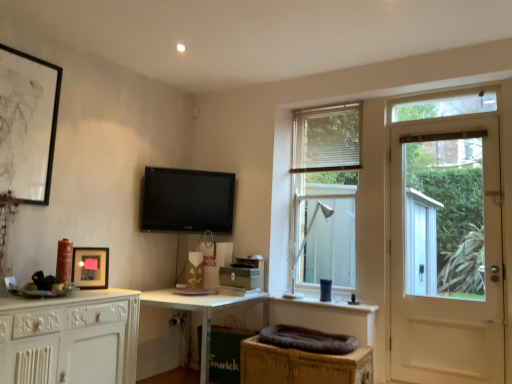
Describe the element at coordinates (304, 246) in the screenshot. I see `white metal table lamp at center` at that location.

Describe the element at coordinates (302, 365) in the screenshot. I see `brown wicker basket at lower center, which is the 1th cabinetry from right to left` at that location.

Describe the element at coordinates (446, 253) in the screenshot. This screenshot has height=384, width=512. I see `white wooden door at right` at that location.

How much space does white matte cabinet at lower left, which appears as the first cabinetry when viewed from the left, occupy vertically?

The height of white matte cabinet at lower left, which appears as the first cabinetry when viewed from the left, is 28.99 inches.

The height and width of the screenshot is (384, 512). Identify the location of white metal table lamp at center. (304, 246).

Does white wood window at center appear on the left side of black glossy tv at upper center?

In fact, white wood window at center is to the right of black glossy tv at upper center.

Is white wood window at center not near black glossy tv at upper center?

No, white wood window at center is not far from black glossy tv at upper center.

Which is correct: white wood window at center is inside black glossy tv at upper center, or outside of it?

white wood window at center cannot be found inside black glossy tv at upper center.

Which of these two, white wood window at center or black glossy tv at upper center, stands shorter?

black glossy tv at upper center.

Does white matte cabinet at lower left, which ranks as the 2th cabinetry in right-to-left order, have a lesser width compared to white wood window at center?

In fact, white matte cabinet at lower left, which ranks as the 2th cabinetry in right-to-left order, might be wider than white wood window at center.

From the picture: Is white matte cabinet at lower left, which ranks as the 2th cabinetry in right-to-left order, at the right side of white wood window at center?

No, white matte cabinet at lower left, which ranks as the 2th cabinetry in right-to-left order, is not to the right of white wood window at center.

From the image's perspective, would you say white matte cabinet at lower left, which ranks as the 2th cabinetry in right-to-left order, is shown under white wood window at center?

Indeed, from the image's perspective, white matte cabinet at lower left, which ranks as the 2th cabinetry in right-to-left order, is shown beneath white wood window at center.

From a real-world perspective, does white matte cabinet at lower left, which ranks as the 2th cabinetry in right-to-left order, sit lower than white wood window at center?

Yes.

In the scene shown: In terms of size, does white wooden door at right appear bigger or smaller than white metal table lamp at center?

Considering their sizes, white wooden door at right takes up more space than white metal table lamp at center.

From a real-world perspective, relative to white metal table lamp at center, is white wooden door at right vertically above or below?

white wooden door at right is above white metal table lamp at center.

Considering the sizes of objects white wooden door at right and white metal table lamp at center in the image provided, who is thinner, white wooden door at right or white metal table lamp at center?

white wooden door at right is thinner.

Between white wooden door at right and white metal table lamp at center, which one appears on the left side from the viewer's perspective?

white metal table lamp at center.

Which is nearer, (80, 284) or (159, 207)?

Clearly, point (80, 284) is closer to the camera than point (159, 207).

From a real-world perspective, which object stands above the other?

black glossy tv at upper center.

Considering the positions of objects matte black picture frame at left, marked as the 1th picture frame in a right-to-left arrangement, and black glossy tv at upper center in the image provided, who is more to the right, matte black picture frame at left, marked as the 1th picture frame in a right-to-left arrangement, or black glossy tv at upper center?

Positioned to the right is black glossy tv at upper center.

Is matte black picture frame at left, the 2th picture frame viewed from the left, oriented away from black glossy tv at upper center?

No, black glossy tv at upper center is not at the back of matte black picture frame at left, the 2th picture frame viewed from the left.

Is brown wicker basket at lower center, which is the 1th cabinetry from right to left, aimed at white wooden door at right?

No, brown wicker basket at lower center, which is the 1th cabinetry from right to left, is not facing towards white wooden door at right.

Is brown wicker basket at lower center, marked as the second cabinetry in a left-to-right arrangement, taller or shorter than white wooden door at right?

brown wicker basket at lower center, marked as the second cabinetry in a left-to-right arrangement, is shorter than white wooden door at right.

Is brown wicker basket at lower center, which is the 1th cabinetry from right to left, not within white wooden door at right?

Indeed, brown wicker basket at lower center, which is the 1th cabinetry from right to left, is completely outside white wooden door at right.

Is white wood window at center facing away from matte black picture frame at upper left, the second picture frame when ordered from bottom to top?

No, white wood window at center is not facing away from matte black picture frame at upper left, the second picture frame when ordered from bottom to top.

From the image's perspective, is white wood window at center over matte black picture frame at upper left, which ranks as the 1th picture frame in left-to-right order?

No, from the image's perspective, white wood window at center is not on top of matte black picture frame at upper left, which ranks as the 1th picture frame in left-to-right order.

Is the surface of white wood window at center in direct contact with matte black picture frame at upper left, which ranks as the 1th picture frame in left-to-right order?

No, white wood window at center is not in contact with matte black picture frame at upper left, which ranks as the 1th picture frame in left-to-right order.

Can you confirm if white wood window at center is shorter than matte black picture frame at upper left, the second picture frame when ordered from bottom to top?

In fact, white wood window at center may be taller than matte black picture frame at upper left, the second picture frame when ordered from bottom to top.

Is matte black picture frame at left, the 2th picture frame viewed from the left, not within white wood window at center?

Yes.

The width and height of the screenshot is (512, 384). I want to click on picture frame below the white wood window at center (from the image's perspective), so click(90, 267).

Looking at the image, does matte black picture frame at left, the second picture frame positioned from the top, seem bigger or smaller compared to white wood window at center?

matte black picture frame at left, the second picture frame positioned from the top, is smaller than white wood window at center.

Which of these two, matte black picture frame at left, the second picture frame positioned from the top, or white wood window at center, is wider?

white wood window at center.

This screenshot has width=512, height=384. In the image, there is a black glossy tv at upper center. What are the coordinates of `window above it (from the image's perspective)` in the screenshot? It's located at [x=326, y=191].

Starting from the white wood window at center, which cabinetry is the 2nd one in front? Please provide its 2D coordinates.

[(70, 338)]

Estimate the real-world distances between objects in this image. Which object is further from white glossy desk at center, matte black picture frame at upper left, which appears as the second picture frame when viewed from the right, or black glossy tv at upper center?

matte black picture frame at upper left, which appears as the second picture frame when viewed from the right.

Estimate the real-world distances between objects in this image. Which object is further from white matte cabinet at lower left, which appears as the first cabinetry when viewed from the left, black glossy tv at upper center or white metal table lamp at center?

Among the two, white metal table lamp at center is located further to white matte cabinet at lower left, which appears as the first cabinetry when viewed from the left.

When comparing their distances from white metal table lamp at center, does matte black picture frame at upper left, the second picture frame when ordered from bottom to top, or matte black picture frame at left, the first picture frame from the bottom, seem closer?

matte black picture frame at left, the first picture frame from the bottom, is positioned closer to the anchor white metal table lamp at center.

Estimate the real-world distances between objects in this image. Which object is further from white wooden door at right, matte black picture frame at upper left, the second picture frame when ordered from bottom to top, or white metal table lamp at center?

matte black picture frame at upper left, the second picture frame when ordered from bottom to top.

Based on their spatial positions, is white metal table lamp at center or brown wicker basket at lower center, marked as the second cabinetry in a left-to-right arrangement, further from white wood window at center?

brown wicker basket at lower center, marked as the second cabinetry in a left-to-right arrangement, is positioned further to the anchor white wood window at center.

Looking at the image, which one is located further to white wooden door at right, matte black picture frame at left, marked as the 1th picture frame in a right-to-left arrangement, or white glossy desk at center?

Among the two, matte black picture frame at left, marked as the 1th picture frame in a right-to-left arrangement, is located further to white wooden door at right.

From the image, which object appears to be nearer to black glossy tv at upper center, matte black picture frame at left, the 2th picture frame viewed from the left, or white wooden door at right?

matte black picture frame at left, the 2th picture frame viewed from the left.

Which object lies further to the anchor point white glossy desk at center, black glossy tv at upper center or white matte cabinet at lower left, which appears as the first cabinetry when viewed from the left?

Among the two, black glossy tv at upper center is located further to white glossy desk at center.

Where is `television located between white matte cabinet at lower left, which appears as the first cabinetry when viewed from the left, and white wood window at center in the left-right direction`? The image size is (512, 384). television located between white matte cabinet at lower left, which appears as the first cabinetry when viewed from the left, and white wood window at center in the left-right direction is located at coordinates (187, 201).

Locate an element on the screen. The image size is (512, 384). cabinetry situated between matte black picture frame at left, the second picture frame positioned from the top, and white metal table lamp at center from left to right is located at coordinates (302, 365).

What are the coordinates of `desk between white wood window at center and brown wicker basket at lower center, marked as the second cabinetry in a left-to-right arrangement, in the up-down direction` in the screenshot? It's located at (198, 311).

The height and width of the screenshot is (384, 512). I want to click on table lamp located between matte black picture frame at upper left, which ranks as the 1th picture frame in left-to-right order, and white wooden door at right in the left-right direction, so click(304, 246).